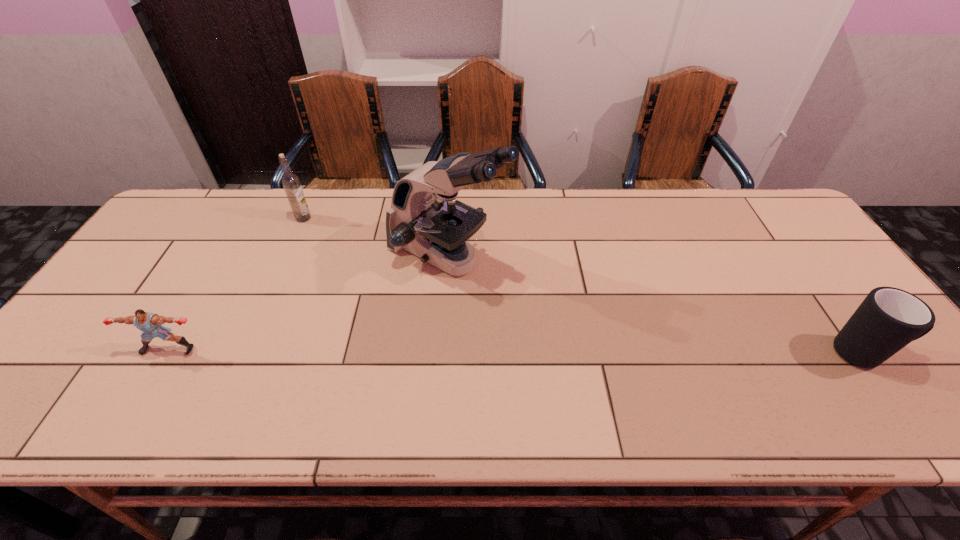
Find the location of a particular element. This screenshot has height=540, width=960. free space located through the eyepieces of the tallest object is located at coordinates (607, 341).

Identify the location of vacant space located through the eyepieces of the tallest object. Image resolution: width=960 pixels, height=540 pixels. click(x=588, y=330).

This screenshot has width=960, height=540. Find the location of `free space located 0.380m on the label of the second tallest object`. free space located 0.380m on the label of the second tallest object is located at coordinates [369, 292].

The height and width of the screenshot is (540, 960). What are the coordinates of `blank space located 0.190m on the label of the second tallest object` in the screenshot? It's located at (335, 254).

Find the location of a particular element. The image size is (960, 540). free region located 0.350m on the label of the second tallest object is located at coordinates (363, 286).

Where is `microscope that is at the far edge`? The image size is (960, 540). microscope that is at the far edge is located at coordinates (425, 218).

Where is `vodka at the far edge`? vodka at the far edge is located at coordinates (290, 181).

Locate an element on the screen. The width and height of the screenshot is (960, 540). puncher that is at the near edge is located at coordinates (150, 324).

Locate an element on the screen. The width and height of the screenshot is (960, 540). mug positioned at the near edge is located at coordinates click(x=888, y=319).

Identify the location of object that is at the left edge. pyautogui.click(x=150, y=324).